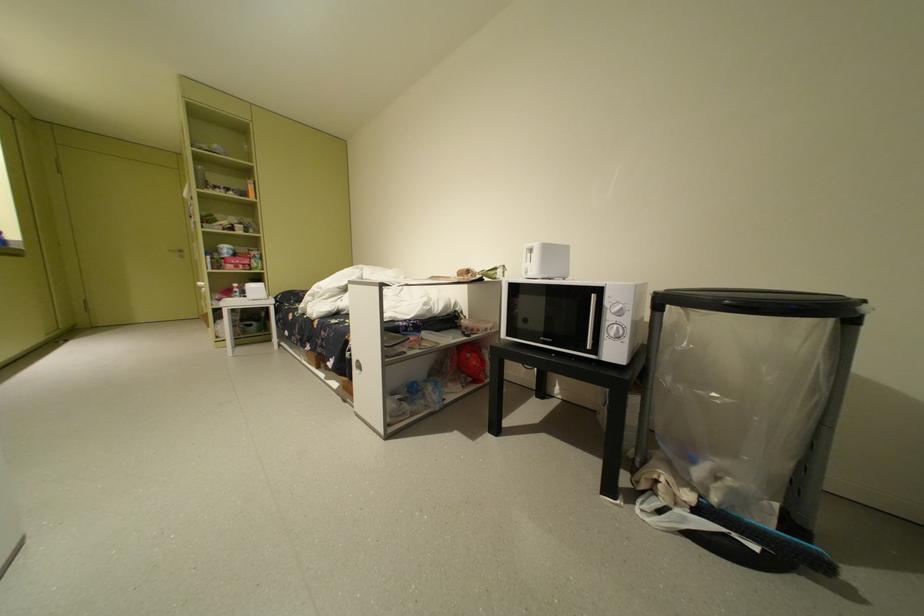
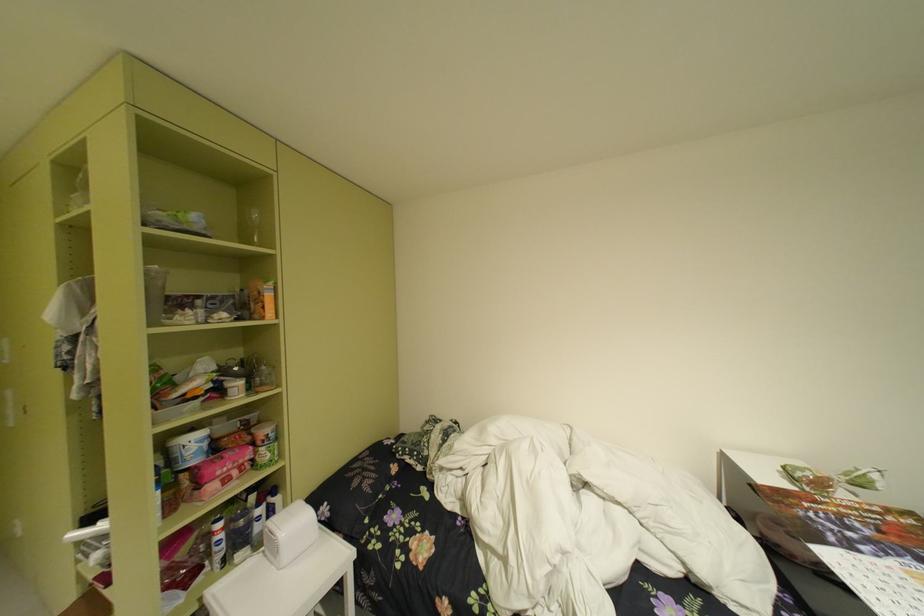
Find the pixel in the second image that matches [249,257] in the first image.

(238, 455)